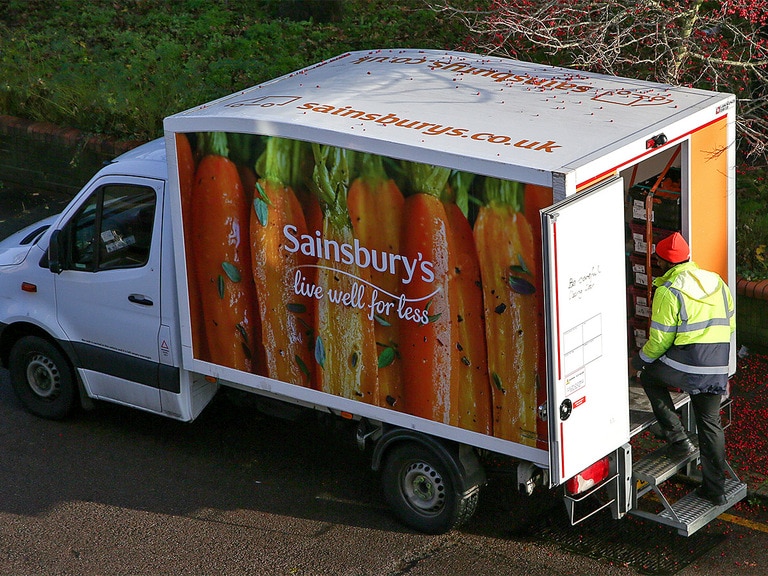
At what (x,y) coordinates should I click in order to perform the action: click on window. Please return your answer as a coordinate pair (x, y). The width and height of the screenshot is (768, 576). Looking at the image, I should click on (88, 244).